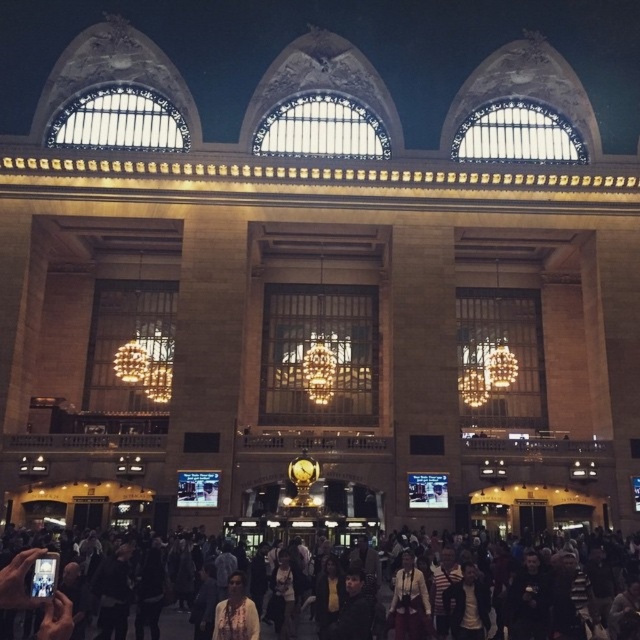
Can you confirm if multicolored clothing at lower center is thinner than white textured shirt at center?

In fact, multicolored clothing at lower center might be wider than white textured shirt at center.

Does multicolored clothing at lower center come behind white textured shirt at center?

That is False.

Measure the distance between point (36,598) and camera.

Point (36,598) is 44.74 meters away from camera.

Locate an element on the screen. This screenshot has height=640, width=640. multicolored clothing at lower center is located at coordinates (544, 604).